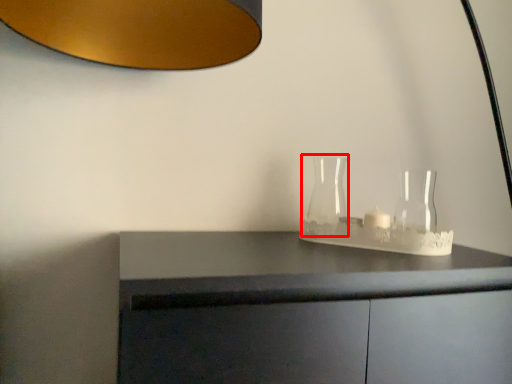
Question: From the image's perspective, considering the relative positions of glass vase (annotated by the red box) and glass vase in the image provided, where is glass vase (annotated by the red box) located with respect to the staircase?

Choices:
 (A) below
 (B) above

Answer: (B)